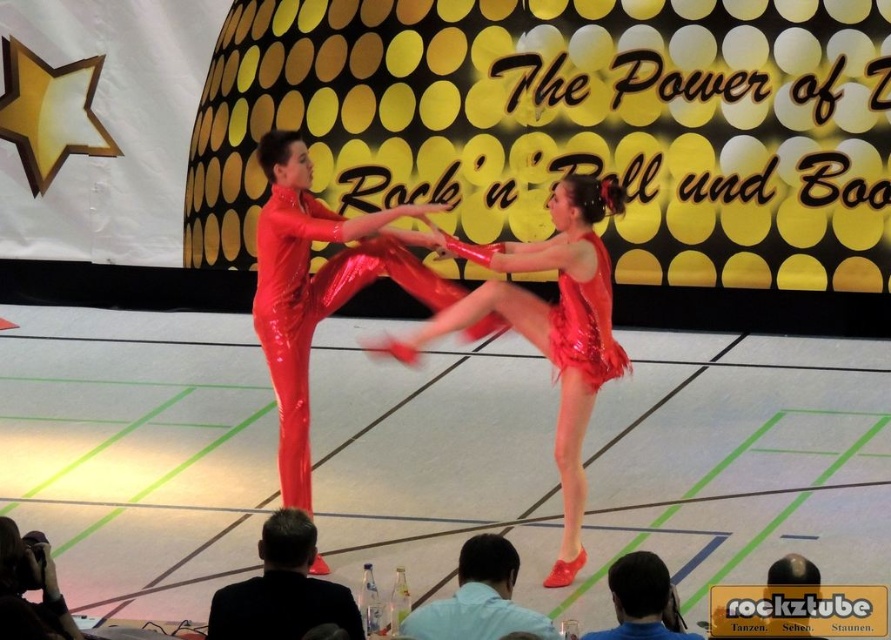
Does shiny red dress at center appear under silvery metallic camera at lower left?

Actually, shiny red dress at center is above silvery metallic camera at lower left.

Can you confirm if shiny red dress at center is smaller than silvery metallic camera at lower left?

No.

I want to click on shiny red dress at center, so click(x=549, y=328).

Locate an element on the screen. shiny red dress at center is located at coordinates (549, 328).

Is shiny red dress at center above black suit at lower center?

Correct, shiny red dress at center is located above black suit at lower center.

Does shiny red dress at center lie in front of black suit at lower center?

No, it is behind black suit at lower center.

At what (x,y) coordinates should I click in order to perform the action: click on shiny red dress at center. Please return your answer as a coordinate pair (x, y). The width and height of the screenshot is (891, 640). Looking at the image, I should click on (549, 328).

How much distance is there between shiny red leotard at center and black suit at lower center?

6.97 feet

The image size is (891, 640). Identify the location of shiny red leotard at center. (319, 285).

Is point (266, 138) closer to viewer compared to point (252, 586)?

That is False.

Image resolution: width=891 pixels, height=640 pixels. Identify the location of shiny red leotard at center. (319, 285).